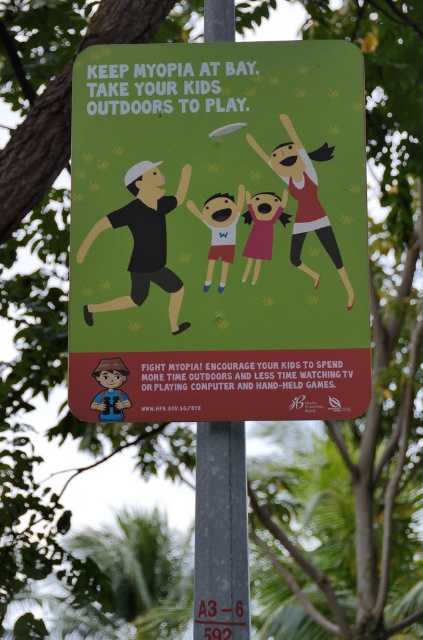
Question: Which of these objects is positioned farthest from the pink paper child at center?

Choices:
 (A) green matte poster at center
 (B) gray metallic pole at center
 (C) matte yellow shirt at center

Answer: (B)

Question: Can you confirm if matte pink dress at upper right is bigger than brown textured hat at lower left?

Choices:
 (A) no
 (B) yes

Answer: (B)

Question: Where is green matte poster at center located in relation to matte pink dress at upper right in the image?

Choices:
 (A) below
 (B) above

Answer: (A)

Question: Estimate the real-world distances between objects in this image. Which object is farther from the pink paper child at center?

Choices:
 (A) black matte figure at center
 (B) green matte poster at center
 (C) matte pink dress at upper right
 (D) gray metallic pole at center

Answer: (D)

Question: Which object is closer to the camera taking this photo?

Choices:
 (A) pink paper child at center
 (B) matte yellow shirt at center
 (C) brown textured hat at lower left

Answer: (C)

Question: From the image, what is the correct spatial relationship of green matte poster at center in relation to matte pink dress at upper right?

Choices:
 (A) above
 (B) below

Answer: (B)